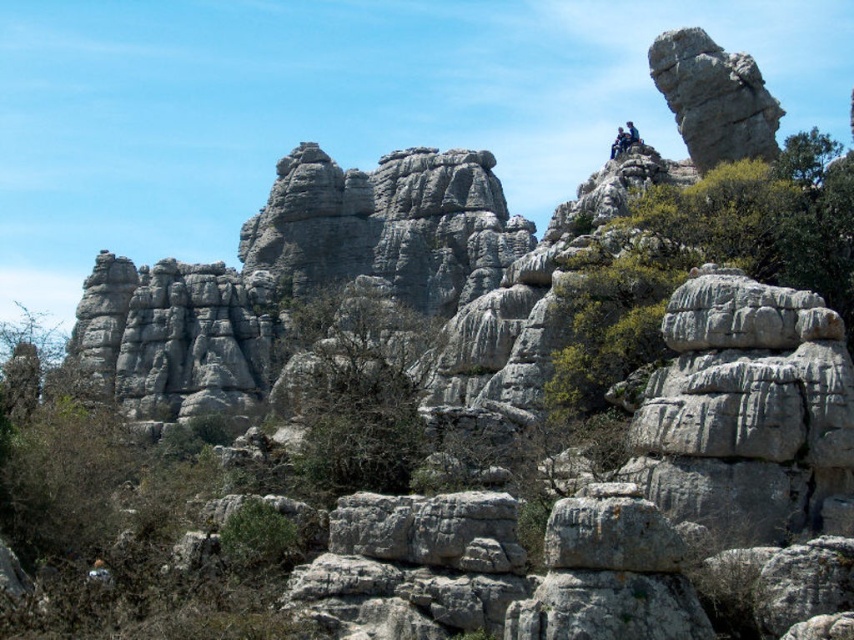
You are a hiker standing at the base of the rocky landscape. You see the gray rock formation at upper right in the distance. If your GPS says you are 250 feet away from it, is the GPS reading accurate?

The gray rock formation at upper right is actually 267.85 feet away from the camera, so the GPS reading of 250 feet is not accurate.

You are a hiker who has spotted the gray rock formation at upper right and the dark blue jeans at upper center in the image. Which object is positioned higher up in the scene?

The gray rock formation at upper right is positioned higher up than the dark blue jeans at upper center, as it is located above it in the scene.

You are standing at the point marked by the coordinates point (355, 388) in the rugged, rocky landscape. What can you see around you?

The point (355, 388) indicates a green leafy tree at center, so you are standing at the center of a green leafy tree surrounded by rugged, rocky terrain with large weathered rock formations, scattered shrubs, and small trees in the midground under a bright blue sky.